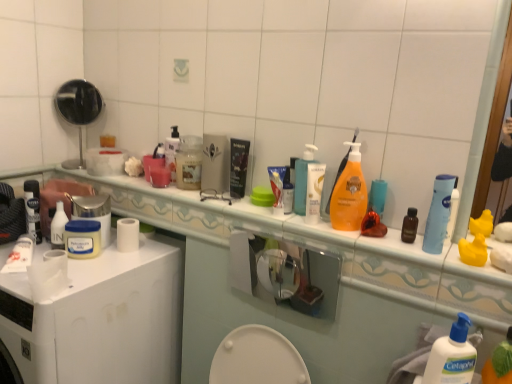
At what (x,y) coordinates should I click in order to perform the action: click on free space in front of orange plastic bottle at center, positioned as the 2th cleaning product in front-to-back order. Please return your answer as a coordinate pair (x, y). This screenshot has width=512, height=384. Looking at the image, I should click on pos(365,240).